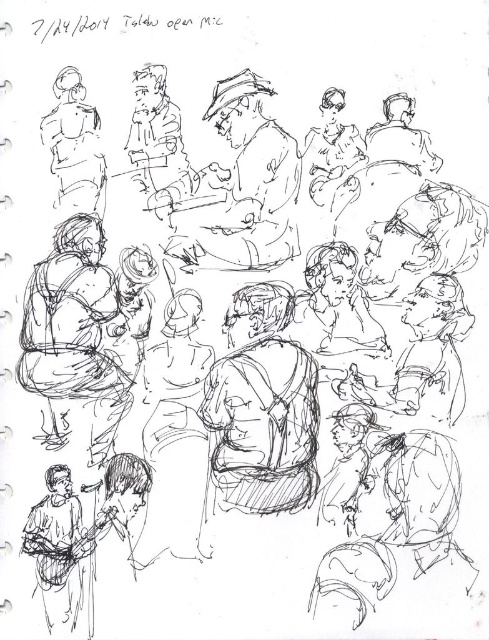
Consider the image. In the drawing, where is the smooth brown jacket at center relative to the matte black figure at upper left?

The smooth brown jacket at center is to the right of the matte black figure at upper left.

You are an art student trying to draw the smooth brown jacket at center in the image. You want to make sure your drawing is to scale. If the jacket in the image is 37.39 inches from you, and your drawing paper is 11 inches wide, can you fit the jacket on the paper?

The smooth brown jacket at center is 37.39 inches from the viewer, which is larger than the 11 inch width of your paper. Therefore, you cannot fit the jacket on the paper at its actual size.

You are an artist who wants to draw a similar sketch. You have two figures to place in the scene. The smooth brown jacket at center and the matte black figure at upper left. Which one should you draw wider to match the original sketch?

The smooth brown jacket at center should be drawn wider because its width surpasses that of the matte black figure at upper left in the original sketch.